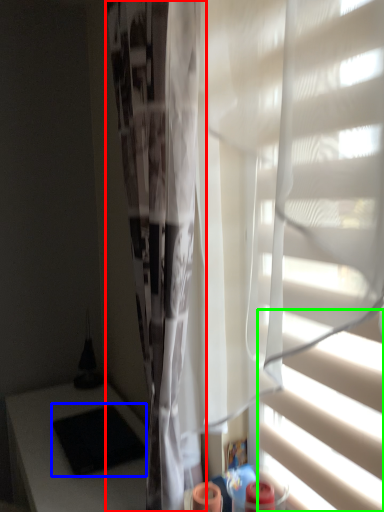
Question: Which object is positioned closest to shower curtain (highlighted by a red box)? Select from pad (highlighted by a blue box) and blind (highlighted by a green box).

Choices:
 (A) pad
 (B) blind

Answer: (B)